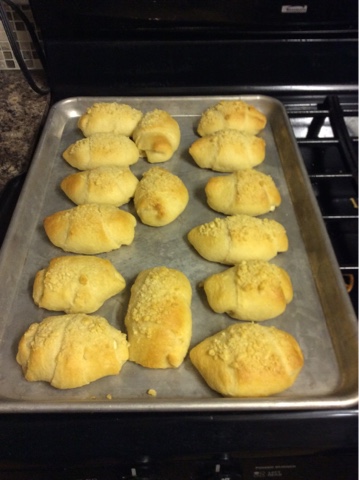
Where is `counter`? The image size is (359, 480). counter is located at coordinates (13, 154).